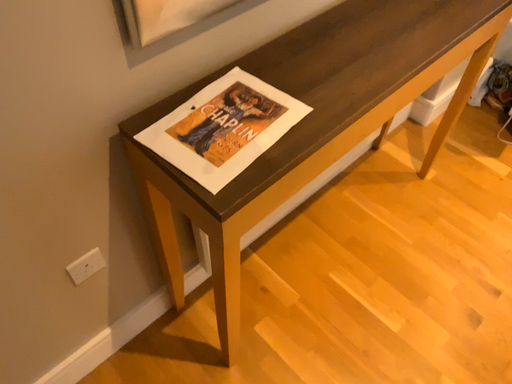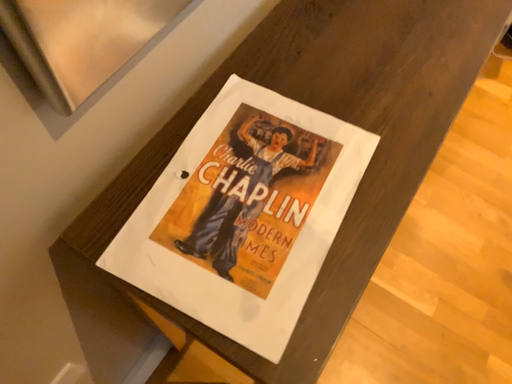
Question: How did the camera likely rotate when shooting the video?

Choices:
 (A) rotated left
 (B) rotated right

Answer: (B)